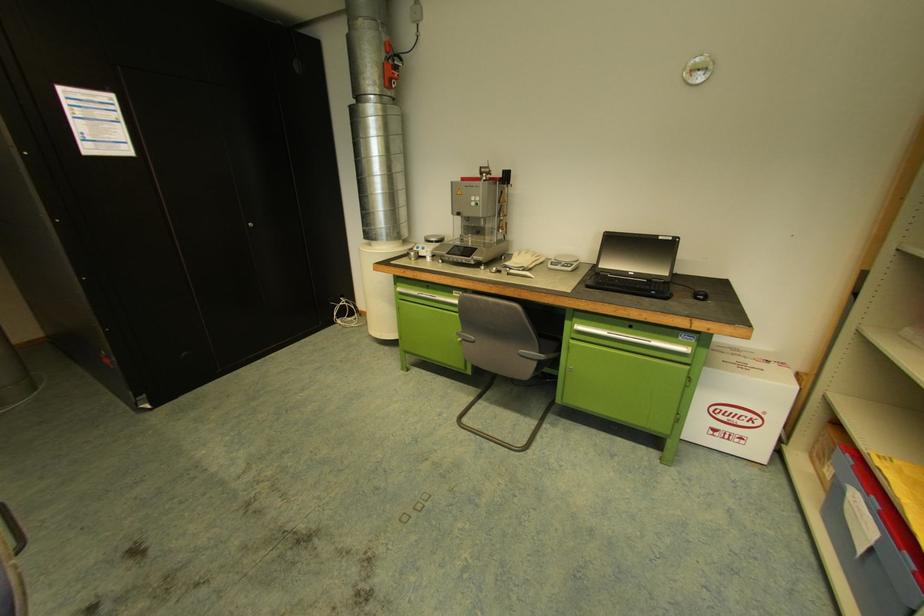
In order to click on green drawer handle in this screenshot , I will do `click(633, 339)`.